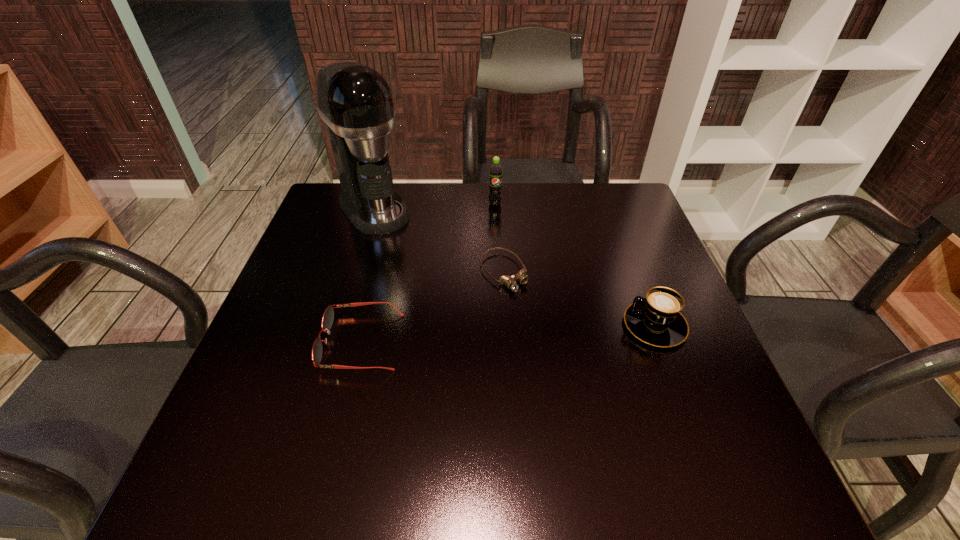
Identify the location of vacant space situated on the front of the third tallest object. (688, 415).

Identify the location of free space located 0.110m place cup under the spout of the coffee maker. (408, 253).

I want to click on free space located 0.070m place cup under the spout of the coffee maker, so click(401, 244).

The width and height of the screenshot is (960, 540). Find the location of `vacant space situated 0.170m place cup under the spout of the coffee maker`. vacant space situated 0.170m place cup under the spout of the coffee maker is located at coordinates (420, 266).

Image resolution: width=960 pixels, height=540 pixels. In order to click on free space located on the front lenses and sides of the third farthest object in this screenshot , I will do `click(626, 422)`.

Where is `free space located on the front lenses and sides of the third farthest object`? The height and width of the screenshot is (540, 960). free space located on the front lenses and sides of the third farthest object is located at coordinates (567, 353).

You are a GUI agent. You are given a task and a screenshot of the screen. Output one action in this format:
    pyautogui.click(x=<x>, y=<y>)
    Task: Click on the vacant space located 0.150m on the front lenses and sides of the third farthest object
    This screenshot has width=960, height=540.
    Given the screenshot: What is the action you would take?
    [x=555, y=339]

Locate an element on the screen. vacant space positioned on the front label of the soda is located at coordinates (498, 269).

This screenshot has height=540, width=960. What are the coordinates of `free space located on the front label of the soda` in the screenshot? It's located at (495, 218).

This screenshot has height=540, width=960. What are the coordinates of `vacant area situated on the front label of the soda` in the screenshot? It's located at (497, 251).